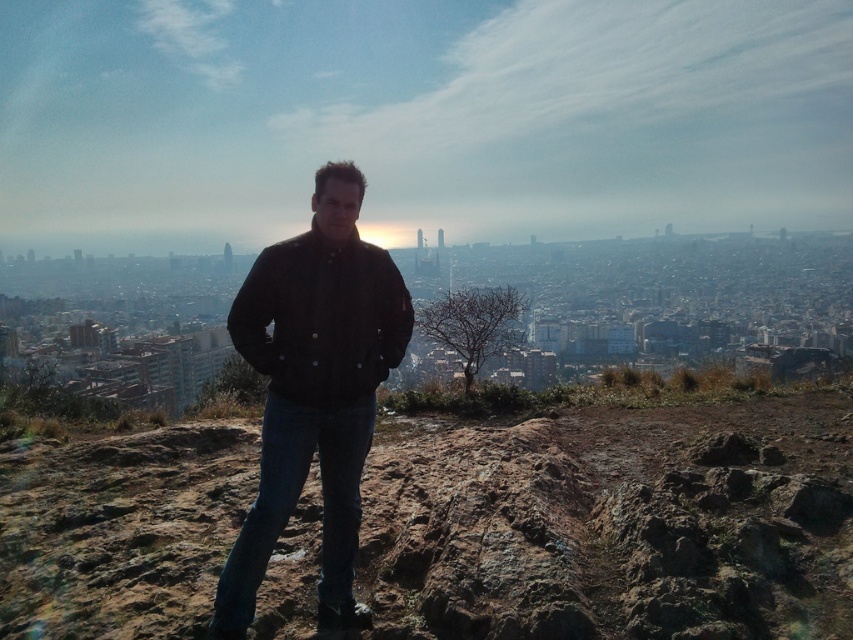
What is the significance of the point marked at coordinates [613,524] in the image?

The point marked at coordinates [613,524] marks the brown rocky hillside at center.

You are a hiker who wants to take a photo of the city from the rocky outcrop. Since you are standing on the brown rocky hillside at center and wearing the dark brown leather jacket at center, which object is closer to the camera?

The dark brown leather jacket at center is closer to the camera because the brown rocky hillside at center is positioned under it.

You are a photographer positioned at the camera location. You want to take a photo that includes both the point at coordinates point [27,460] and point [345,572]. Which point is closer to the camera and should be focused on first?

Point [27,460] is closer to the camera than point [345,572], so you should focus on point [27,460] first.